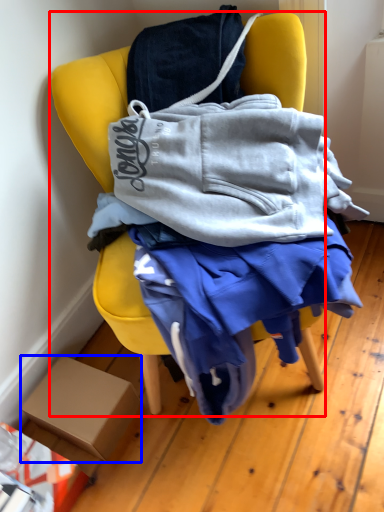
Question: Which of the following is the farthest to the observer, chair (highlighted by a red box) or box (highlighted by a blue box)?

Choices:
 (A) chair
 (B) box

Answer: (B)